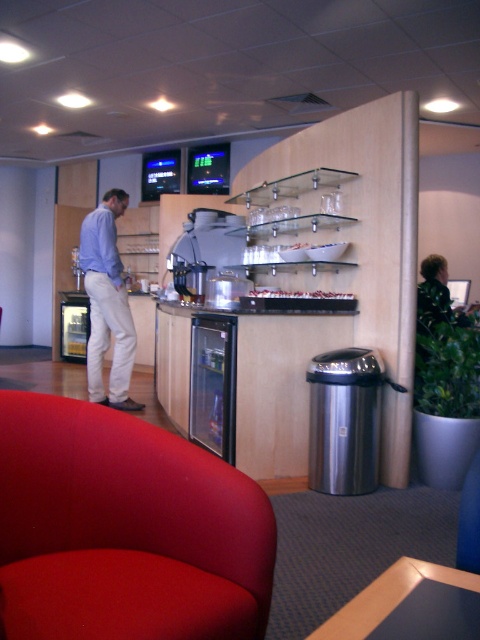
Is matte blue shirt at center below translucent glass cups at upper center?

Indeed, matte blue shirt at center is positioned under translucent glass cups at upper center.

From the picture: Does matte blue shirt at center have a greater height compared to translucent glass cups at upper center?

Yes.

Describe the element at coordinates (107, 304) in the screenshot. I see `matte blue shirt at center` at that location.

You are a GUI agent. You are given a task and a screenshot of the screen. Output one action in this format:
    pyautogui.click(x=<x>, y=<y>)
    Task: Click on the matte blue shirt at center
    The height and width of the screenshot is (640, 480).
    Given the screenshot: What is the action you would take?
    pyautogui.click(x=107, y=304)

Who is more forward, (195, 486) or (315, 292)?

Point (195, 486) is more forward.

Is velvet red armchair at lower left taller than translucent glass cups at upper center?

Yes, velvet red armchair at lower left is taller than translucent glass cups at upper center.

Is point (155, 554) farther from camera compared to point (343, 294)?

That is False.

Locate an element on the screen. The image size is (480, 640). velvet red armchair at lower left is located at coordinates (124, 529).

Which is in front, point (203, 572) or point (104, 212)?

Point (203, 572)

Which is behind, point (108, 561) or point (118, 260)?

The point (118, 260) is behind.

Where is `velvet red armchair at lower left`? This screenshot has height=640, width=480. velvet red armchair at lower left is located at coordinates (124, 529).